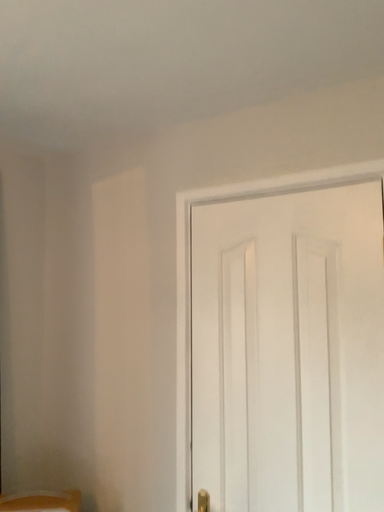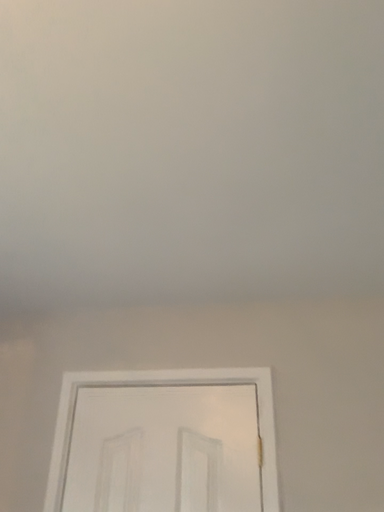
Question: Which way did the camera rotate in the video?

Choices:
 (A) rotated downward
 (B) rotated upward

Answer: (B)